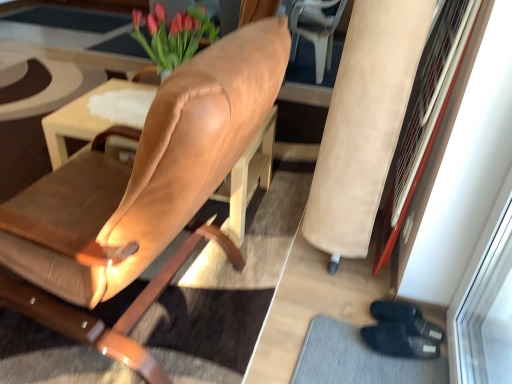
Question: From their relative heights in the image, would you say black fabric doormat at lower right is taller or shorter than suede-like beige armchair at right?

Choices:
 (A) tall
 (B) short

Answer: (B)

Question: Is black fabric doormat at lower right in front of or behind suede-like beige armchair at right in the image?

Choices:
 (A) front
 (B) behind

Answer: (B)

Question: Which object is positioned farthest from the leather chair at center?

Choices:
 (A) suede-like beige armchair at right
 (B) matte brown table at center
 (C) leather armchair at upper right
 (D) black fabric doormat at lower right

Answer: (C)

Question: Estimate the real-world distances between objects in this image. Which object is farther from the suede-like beige armchair at right?

Choices:
 (A) leather armchair at upper right
 (B) leather chair at center
 (C) black fabric doormat at lower right
 (D) matte brown table at center

Answer: (A)